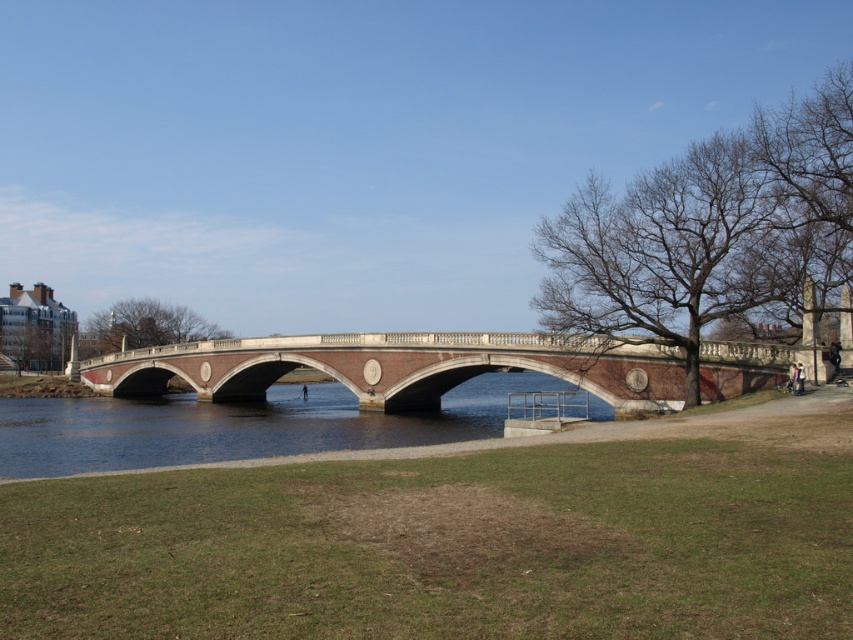
You are standing at the riverside and want to cross to the other side using the brick stone bridge at center. If your walking speed is 1.5 meters per second, how many seconds will it take you to reach the bridge?

The brick stone bridge at center is 38.62 meters away from the viewer. At a walking speed of 1.5 meters per second, it will take approximately 25.75 seconds to reach the bridge.

You are an architect designing a miniature model of this riverside scene. The scale model requires all objects to be proportionally sized. Given that the brick stone bridge at center is larger than the black matte person at center in the original image, how should you adjust their sizes in the model to maintain accuracy?

To maintain accuracy in the scale model, the brick stone bridge at center should be made larger than the black matte person at center, as it is proportionally bigger in the original image.